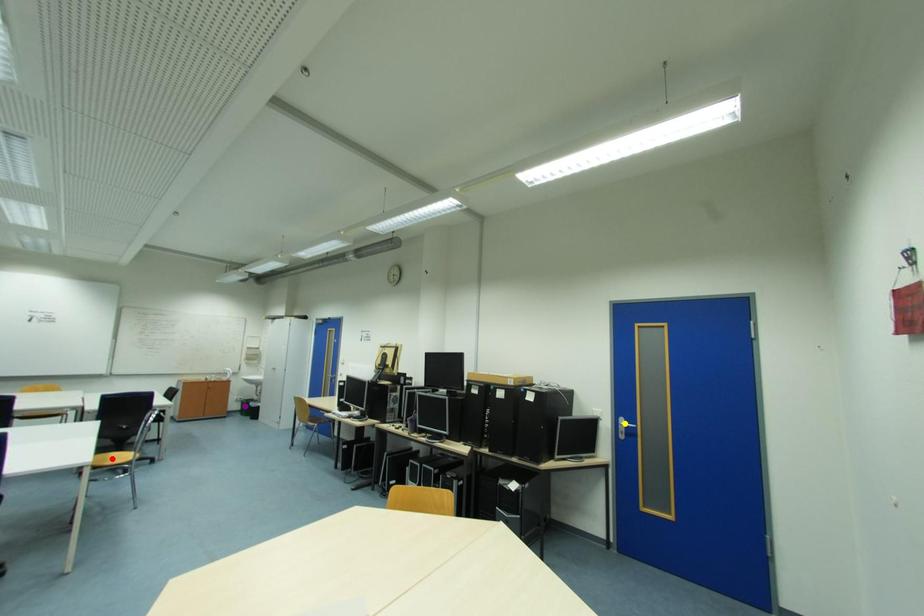
Order these from nearest to farthest:
red point, yellow point, purple point

red point → yellow point → purple point